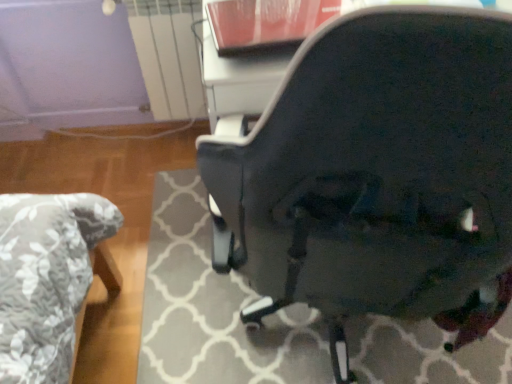
In the scene shown: Measure the distance between glossy black chair at center and camera.

A distance of 12.70 inches exists between glossy black chair at center and camera.

You are a GUI agent. You are given a task and a screenshot of the screen. Output one action in this format:
    pyautogui.click(x=<x>, y=<y>)
    Task: Click on the glossy black chair at center
    The height and width of the screenshot is (384, 512).
    Given the screenshot: What is the action you would take?
    pyautogui.click(x=376, y=176)

What do you see at coordinates (376, 176) in the screenshot?
I see `glossy black chair at center` at bounding box center [376, 176].

This screenshot has width=512, height=384. Identify the location of glossy black chair at center. (376, 176).